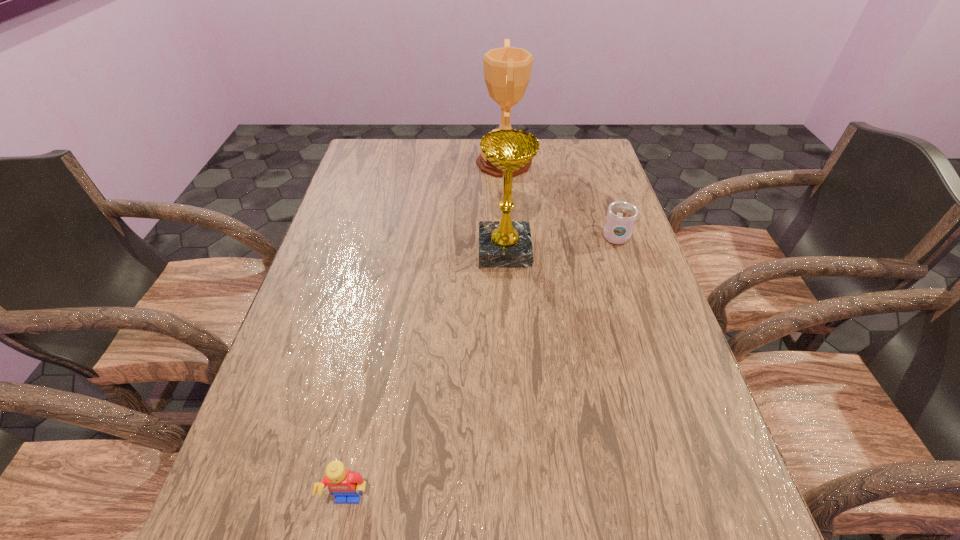
Identify the location of the farthest object. pos(507,70).

Identify the location of the second tallest object. The image size is (960, 540). (502, 244).

At what (x,y) coordinates should I click in order to perform the action: click on the nearer award. Please return your answer as a coordinate pair (x, y). This screenshot has height=540, width=960. Looking at the image, I should click on (502, 244).

Where is `cup`? This screenshot has width=960, height=540. cup is located at coordinates (621, 216).

Locate an element on the screen. the nearest object is located at coordinates (346, 486).

You are a GUI agent. You are given a task and a screenshot of the screen. Output one action in this format:
    pyautogui.click(x=<x>, y=<y>)
    Task: Click on the leftmost object
    The width and height of the screenshot is (960, 540).
    Given the screenshot: What is the action you would take?
    pyautogui.click(x=346, y=486)

Find the location of `vacant region located on the front-facing side of the farther award`. vacant region located on the front-facing side of the farther award is located at coordinates (358, 163).

The image size is (960, 540). In order to click on vacant space located 0.280m on the front-facing side of the farther award in this screenshot , I will do `click(394, 163)`.

This screenshot has height=540, width=960. What are the coordinates of `free space located 0.350m on the front-facing side of the farther award` in the screenshot? It's located at (373, 163).

Where is `vacant space located on the front-facing side of the nearer award`? The image size is (960, 540). vacant space located on the front-facing side of the nearer award is located at coordinates (382, 250).